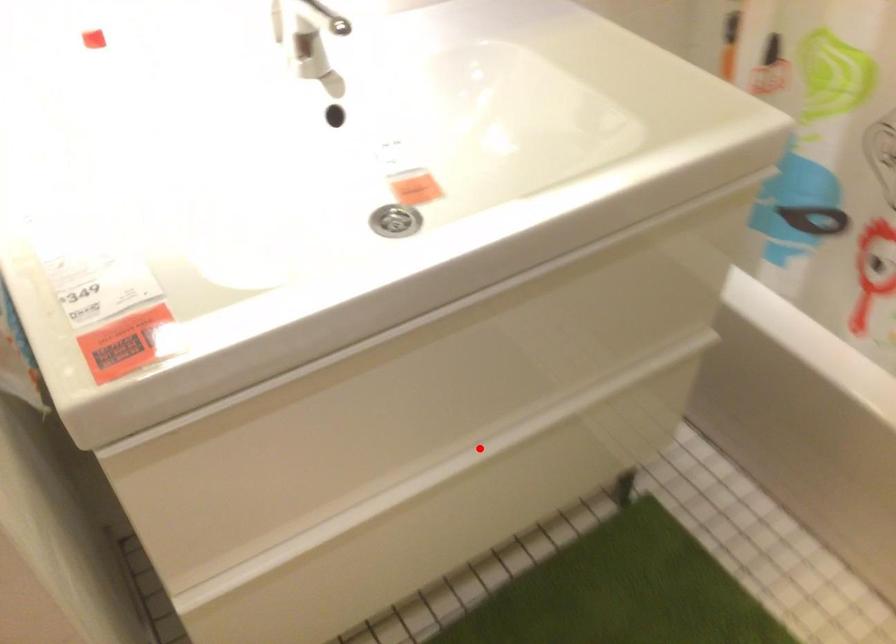
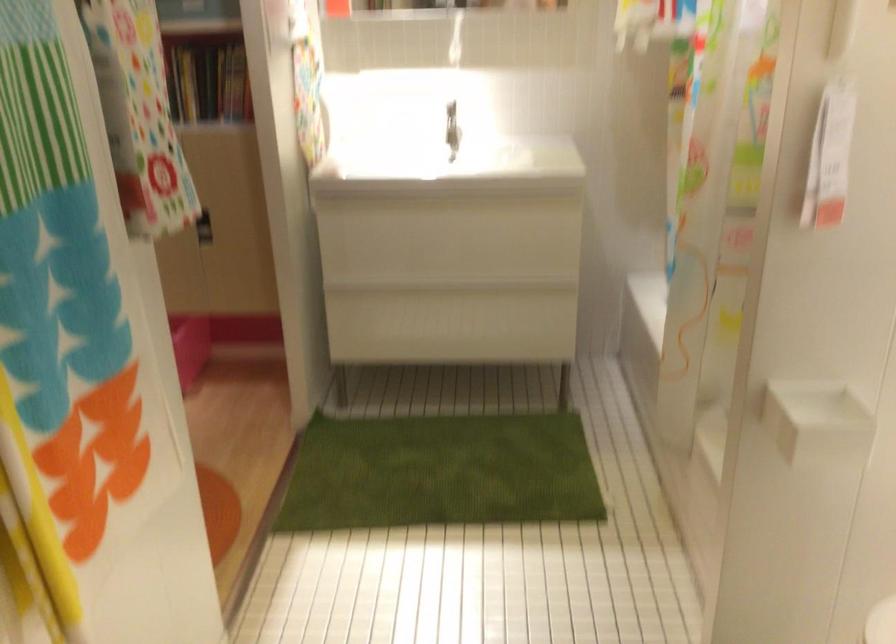
Find the pixel in the second image that matches the highlighted location in the first image.

(453, 288)